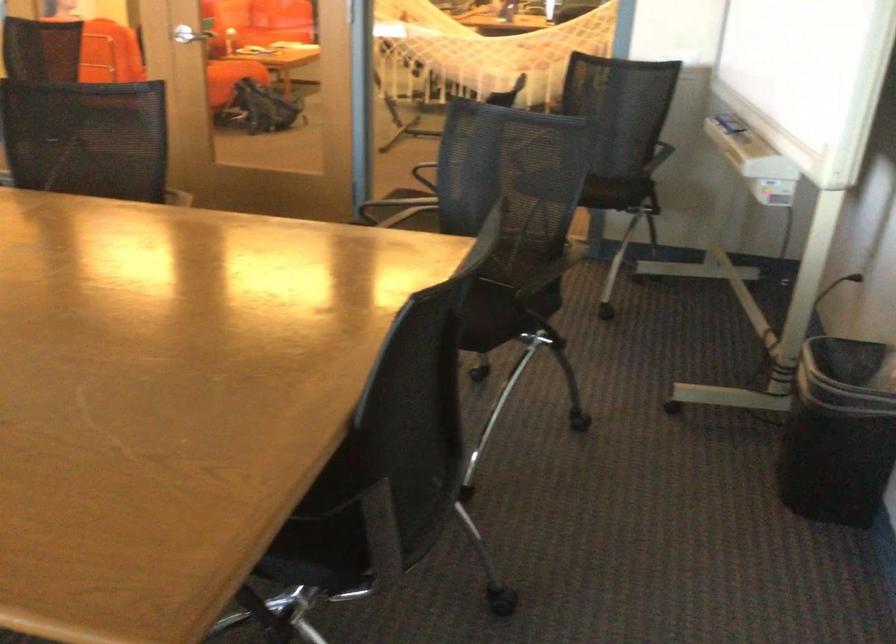
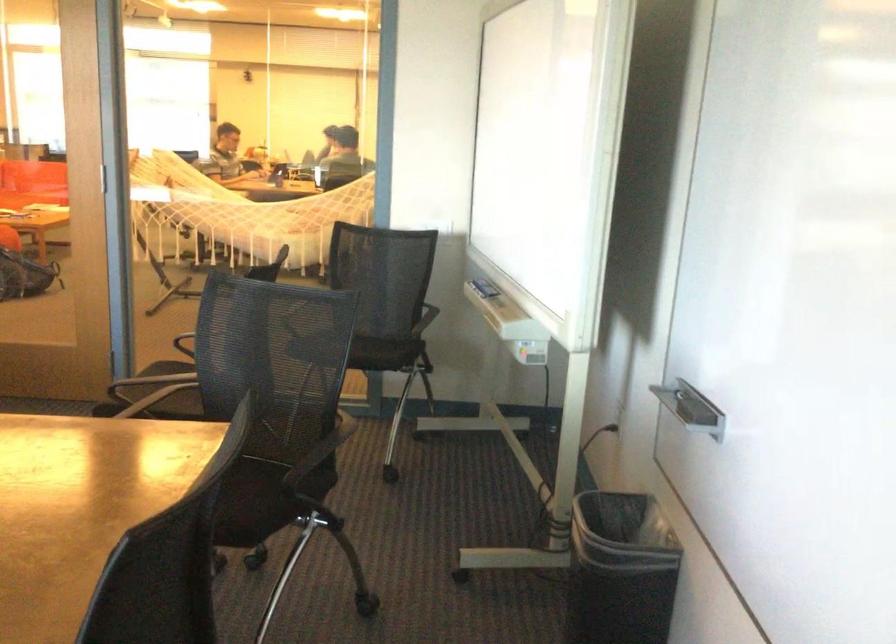
Find the pixel in the second image that matches (477,307) in the first image.

(243, 494)